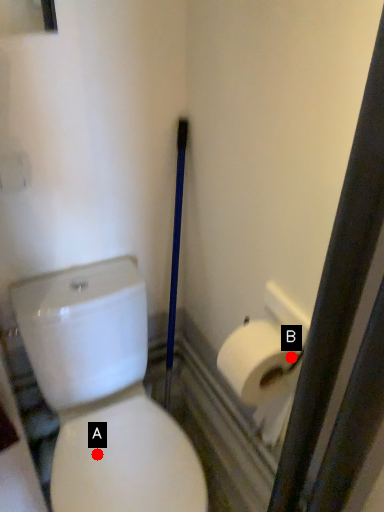
Question: Two points are circled on the image, labeled by A and B beside each circle. Which point is farther from the camera taking this photo?

Choices:
 (A) A is further
 (B) B is further

Answer: (A)